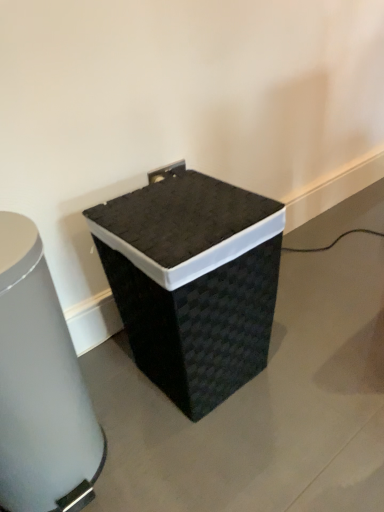
Question: In the image, is black woven trash can at center, arranged as the first waste container when viewed from the left, positioned in front of or behind black woven waste container at center, the 2th waste container from the left?

Choices:
 (A) front
 (B) behind

Answer: (A)

Question: Is black woven trash can at center, arranged as the first waste container when viewed from the left, wider or thinner than black woven waste container at center, acting as the first waste container starting from the right?

Choices:
 (A) thin
 (B) wide

Answer: (A)

Question: From their relative heights in the image, would you say black woven trash can at center, arranged as the first waste container when viewed from the left, is taller or shorter than black woven waste container at center, acting as the first waste container starting from the right?

Choices:
 (A) tall
 (B) short

Answer: (A)

Question: Is black woven waste container at center, acting as the first waste container starting from the right, wider or thinner than black woven trash can at center, marked as the 2th waste container in a right-to-left arrangement?

Choices:
 (A) thin
 (B) wide

Answer: (B)

Question: From a real-world perspective, relative to black woven trash can at center, marked as the 2th waste container in a right-to-left arrangement, is black woven waste container at center, the 2th waste container from the left, vertically above or below?

Choices:
 (A) below
 (B) above

Answer: (A)

Question: Is black woven waste container at center, acting as the first waste container starting from the right, in front of or behind black woven trash can at center, arranged as the first waste container when viewed from the left, in the image?

Choices:
 (A) front
 (B) behind

Answer: (B)

Question: From their relative heights in the image, would you say black woven waste container at center, the 2th waste container from the left, is taller or shorter than black woven trash can at center, arranged as the first waste container when viewed from the left?

Choices:
 (A) short
 (B) tall

Answer: (A)